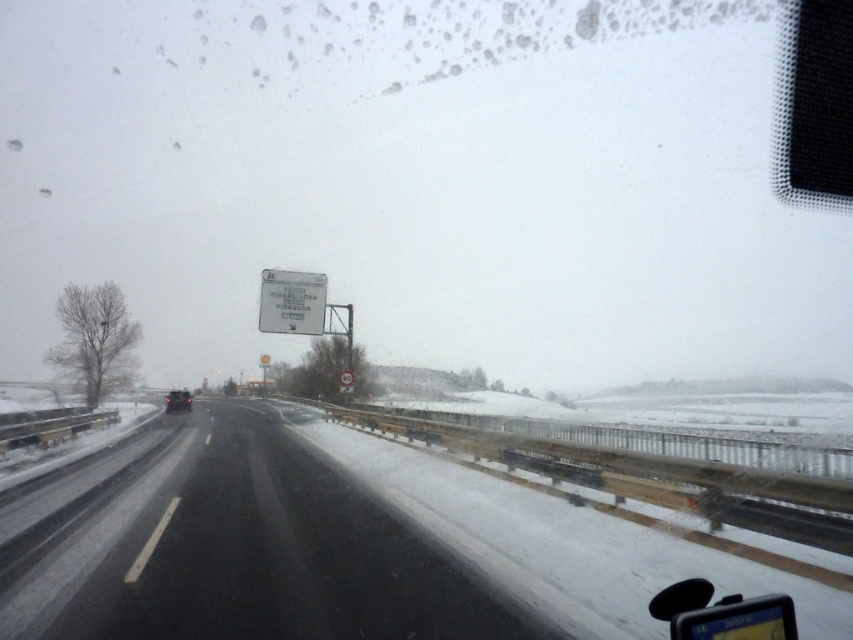
Does black asphalt highway at center have a lesser width compared to white paper sign at upper center?

In fact, black asphalt highway at center might be wider than white paper sign at upper center.

Between point (125, 614) and point (320, 298), which one is positioned behind?

Point (320, 298)

Where is `black asphalt highway at center`? The image size is (853, 640). black asphalt highway at center is located at coordinates (230, 547).

Is white paper sign at upper center bigger than matte black car at center?

Incorrect, white paper sign at upper center is not larger than matte black car at center.

Between point (323, 284) and point (178, 410), which one is positioned in front?

Positioned in front is point (323, 284).

I want to click on white paper sign at upper center, so click(x=292, y=301).

Between point (294, 472) and point (177, 401), which one is positioned behind?

The point (177, 401) is behind.

What do you see at coordinates (230, 547) in the screenshot?
I see `black asphalt highway at center` at bounding box center [230, 547].

The width and height of the screenshot is (853, 640). What are the coordinates of `black asphalt highway at center` in the screenshot? It's located at (230, 547).